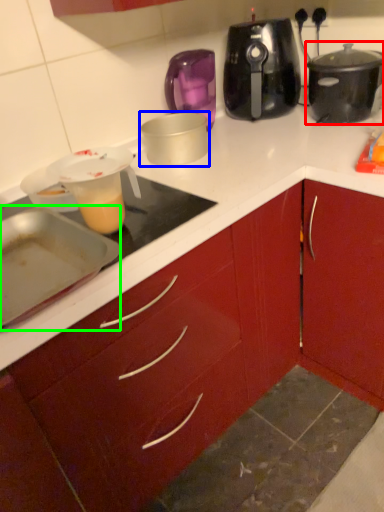
Question: Based on their relative distances, which object is farther from slow cooker (highlighted by a red box)? Choose from kitchen appliance (highlighted by a blue box) and kitchen appliance (highlighted by a green box).

Choices:
 (A) kitchen appliance
 (B) kitchen appliance

Answer: (B)